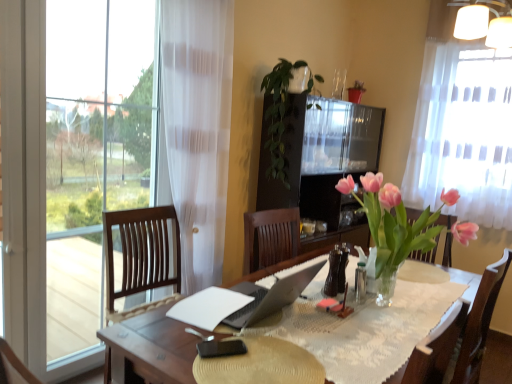
Question: From the image's perspective, does green leafy plant at center appear higher than white paper at center?

Choices:
 (A) no
 (B) yes

Answer: (B)

Question: Is green leafy plant at center closer to the viewer compared to white paper at center?

Choices:
 (A) yes
 (B) no

Answer: (B)

Question: Are green leafy plant at center and white paper at center beside each other?

Choices:
 (A) yes
 (B) no

Answer: (B)

Question: From a real-world perspective, is green leafy plant at center positioned under white paper at center based on gravity?

Choices:
 (A) no
 (B) yes

Answer: (A)

Question: From the image's perspective, is green leafy plant at center under white paper at center?

Choices:
 (A) yes
 (B) no

Answer: (B)

Question: Is black matte phone at center spatially inside green leafy plant at center, or outside of it?

Choices:
 (A) inside
 (B) outside

Answer: (B)

Question: Is black matte phone at center in front of or behind green leafy plant at center in the image?

Choices:
 (A) behind
 (B) front

Answer: (B)

Question: Is black matte phone at center taller or shorter than green leafy plant at center?

Choices:
 (A) short
 (B) tall

Answer: (A)

Question: From the image's perspective, is black matte phone at center positioned above or below green leafy plant at center?

Choices:
 (A) below
 (B) above

Answer: (A)

Question: From the image's perspective, is white sheer curtain at upper right positioned above or below green leafy plant at center?

Choices:
 (A) above
 (B) below

Answer: (A)

Question: In the image, is white sheer curtain at upper right positioned in front of or behind green leafy plant at center?

Choices:
 (A) front
 (B) behind

Answer: (B)

Question: In terms of size, does white sheer curtain at upper right appear bigger or smaller than green leafy plant at center?

Choices:
 (A) big
 (B) small

Answer: (A)

Question: Looking at their shapes, would you say white sheer curtain at upper right is wider or thinner than green leafy plant at center?

Choices:
 (A) thin
 (B) wide

Answer: (A)

Question: Is white matte lampshade at upper right situated inside white paper at center or outside?

Choices:
 (A) outside
 (B) inside

Answer: (A)

Question: Considering the positions of white matte lampshade at upper right and white paper at center in the image, is white matte lampshade at upper right taller or shorter than white paper at center?

Choices:
 (A) tall
 (B) short

Answer: (A)